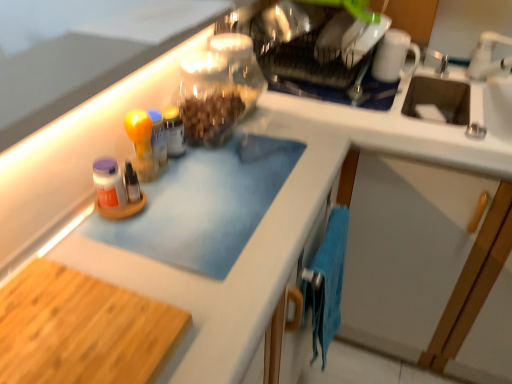
Question: Considering the relative sizes of translucent glass jar at center and white glossy mug at upper right in the image provided, is translucent glass jar at center taller than white glossy mug at upper right?

Choices:
 (A) no
 (B) yes

Answer: (A)

Question: Could you tell me if translucent glass jar at center is facing white glossy mug at upper right?

Choices:
 (A) yes
 (B) no

Answer: (B)

Question: Can you confirm if translucent glass jar at center is positioned to the left of white glossy mug at upper right?

Choices:
 (A) yes
 (B) no

Answer: (A)

Question: Is translucent glass jar at center bigger than white glossy mug at upper right?

Choices:
 (A) no
 (B) yes

Answer: (A)

Question: From the image's perspective, is translucent glass jar at center on top of white glossy mug at upper right?

Choices:
 (A) yes
 (B) no

Answer: (B)

Question: Are translucent glass jar at center and white glossy mug at upper right making contact?

Choices:
 (A) no
 (B) yes

Answer: (A)

Question: Is white ceramic faucet at upper right positioned far away from blue microfiber towel at lower right?

Choices:
 (A) yes
 (B) no

Answer: (B)

Question: Is white ceramic faucet at upper right bigger than blue microfiber towel at lower right?

Choices:
 (A) yes
 (B) no

Answer: (B)

Question: Is white ceramic faucet at upper right facing towards blue microfiber towel at lower right?

Choices:
 (A) yes
 (B) no

Answer: (B)

Question: Considering the relative positions of white ceramic faucet at upper right and blue microfiber towel at lower right in the image provided, is white ceramic faucet at upper right to the left of blue microfiber towel at lower right from the viewer's perspective?

Choices:
 (A) yes
 (B) no

Answer: (B)

Question: Is white ceramic faucet at upper right at the right side of blue microfiber towel at lower right?

Choices:
 (A) yes
 (B) no

Answer: (A)

Question: From the image's perspective, would you say white ceramic faucet at upper right is positioned over blue microfiber towel at lower right?

Choices:
 (A) no
 (B) yes

Answer: (B)

Question: From a real-world perspective, is white ceramic faucet at upper right located higher than clear glass jar at upper center?

Choices:
 (A) no
 (B) yes

Answer: (B)